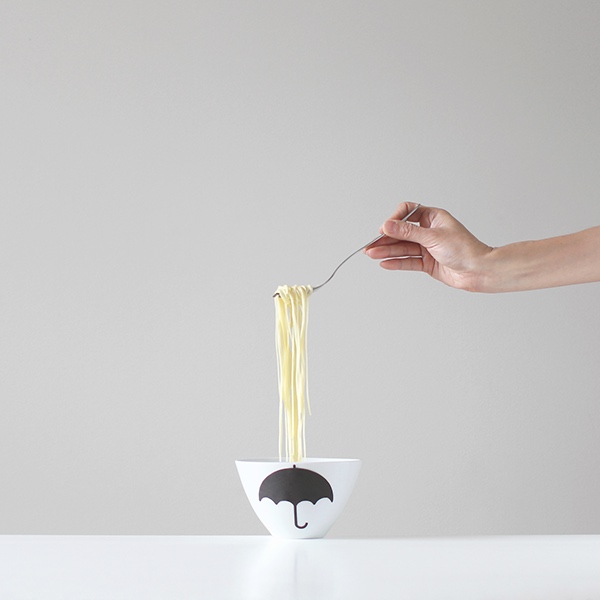
Image resolution: width=600 pixels, height=600 pixels. Identify the location of silver fork. (315, 285).